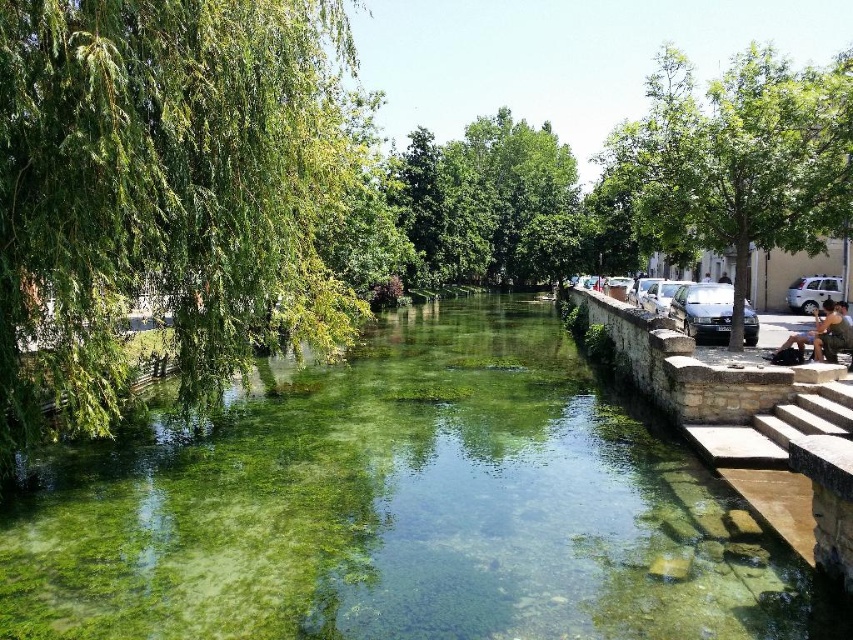
Question: Is clear stone river at center in front of green leafy tree at right?

Choices:
 (A) no
 (B) yes

Answer: (B)

Question: Which object is farther from the camera taking this photo?

Choices:
 (A) green leafy tree at right
 (B) green leafy tree at center
 (C) clear stone river at center

Answer: (B)

Question: Considering the relative positions of clear stone river at center and camouflage fabric person at right in the image provided, where is clear stone river at center located with respect to camouflage fabric person at right?

Choices:
 (A) below
 (B) above

Answer: (A)

Question: Among these objects, which one is nearest to the camera?

Choices:
 (A) gray stone stairs at right
 (B) green leafy tree at center
 (C) camouflage fabric person at right

Answer: (A)

Question: Which point appears closest to the camera in this image?

Choices:
 (A) (677, 93)
 (B) (485, 611)

Answer: (B)

Question: Is clear stone river at center positioned behind gray stone stairs at right?

Choices:
 (A) yes
 (B) no

Answer: (B)